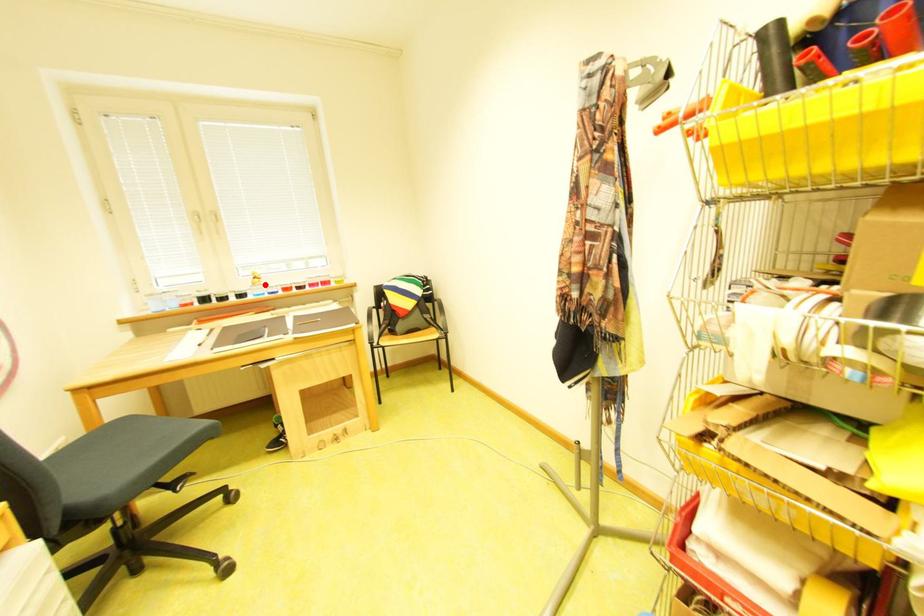
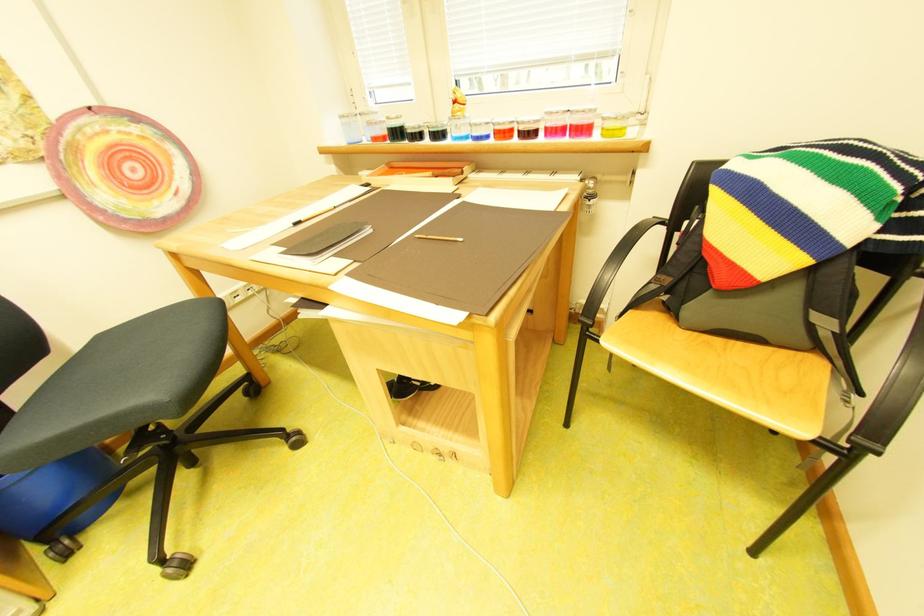
The point at the highlighted location is marked in the first image. Where is the corresponding point in the second image?

(465, 115)